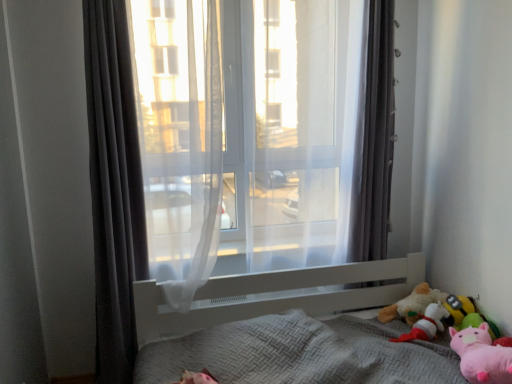
Question: Is pink plush toy at lower right behind dark gray fabric curtain at left, the first curtain from the left?

Choices:
 (A) no
 (B) yes

Answer: (A)

Question: Could you tell me if pink plush toy at lower right is turned towards dark gray fabric curtain at left, the first curtain from the left?

Choices:
 (A) yes
 (B) no

Answer: (B)

Question: Is pink plush toy at lower right closer to the viewer compared to dark gray fabric curtain at left, placed as the 2th curtain when sorted from right to left?

Choices:
 (A) no
 (B) yes

Answer: (B)

Question: Is pink plush toy at lower right located outside dark gray fabric curtain at left, the first curtain from the left?

Choices:
 (A) no
 (B) yes

Answer: (B)

Question: Is pink plush toy at lower right far from dark gray fabric curtain at left, the first curtain from the left?

Choices:
 (A) yes
 (B) no

Answer: (A)

Question: From the image's perspective, is pink plush toy at lower right over dark gray fabric curtain at left, placed as the 2th curtain when sorted from right to left?

Choices:
 (A) yes
 (B) no

Answer: (B)

Question: Considering the relative sizes of dark gray fabric curtain at right, arranged as the first curtain when viewed from the right, and soft plush toy at lower right, the 2th toy in the back-to-front sequence, in the image provided, is dark gray fabric curtain at right, arranged as the first curtain when viewed from the right, bigger than soft plush toy at lower right, the 2th toy in the back-to-front sequence,?

Choices:
 (A) yes
 (B) no

Answer: (A)

Question: From a real-world perspective, is dark gray fabric curtain at right, which is the second curtain in left-to-right order, positioned over soft plush toy at lower right, the 2th toy in the back-to-front sequence, based on gravity?

Choices:
 (A) yes
 (B) no

Answer: (A)

Question: Is dark gray fabric curtain at right, which is the second curtain in left-to-right order, closer to the viewer compared to soft plush toy at lower right, the 3th toy when ordered from front to back?

Choices:
 (A) yes
 (B) no

Answer: (B)

Question: Is dark gray fabric curtain at right, arranged as the first curtain when viewed from the right, shorter than soft plush toy at lower right, the 2th toy in the back-to-front sequence?

Choices:
 (A) no
 (B) yes

Answer: (A)

Question: Is dark gray fabric curtain at right, which is the second curtain in left-to-right order, to the right of soft plush toy at lower right, the 2th toy in the back-to-front sequence, from the viewer's perspective?

Choices:
 (A) no
 (B) yes

Answer: (A)

Question: Is soft plush toy at lower right, the 3th toy when ordered from front to back, a part of dark gray fabric curtain at right, which is the second curtain in left-to-right order?

Choices:
 (A) yes
 (B) no

Answer: (B)

Question: Is dark gray fabric curtain at left, placed as the 2th curtain when sorted from right to left, placed right next to fluffy plush toy at lower right, placed as the fourth toy when sorted from front to back?

Choices:
 (A) yes
 (B) no

Answer: (B)